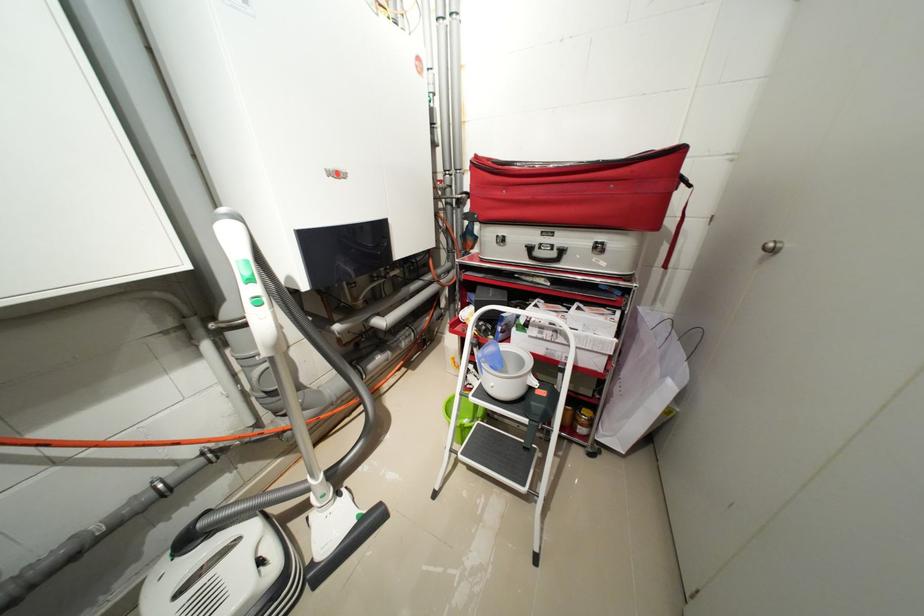
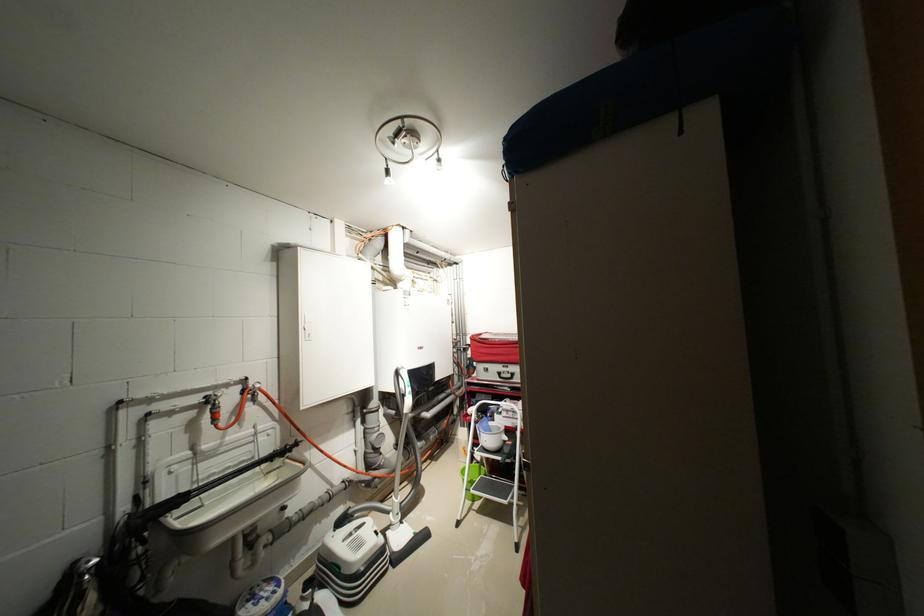
In the second image, find the point that corresponds to the point at 369,520 in the first image.

(423, 536)